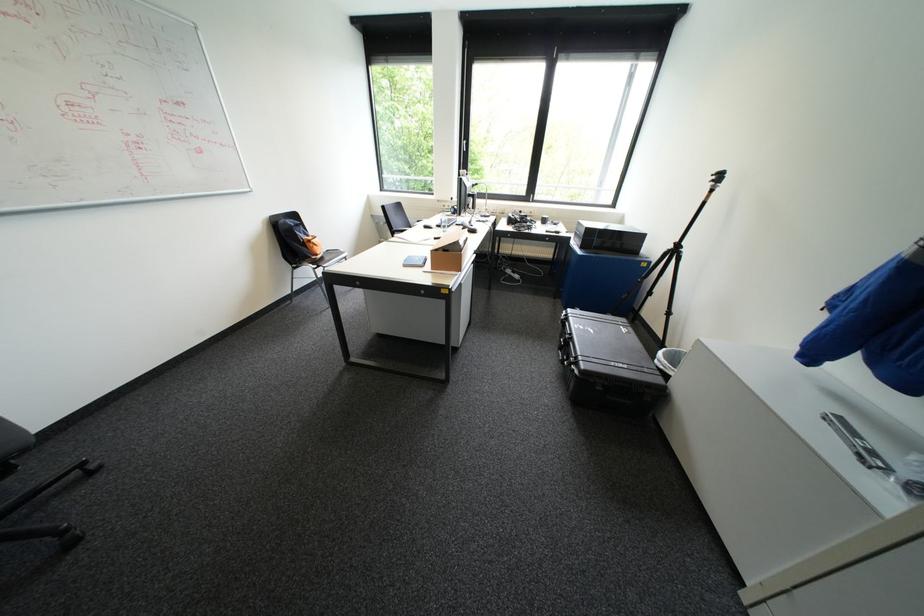
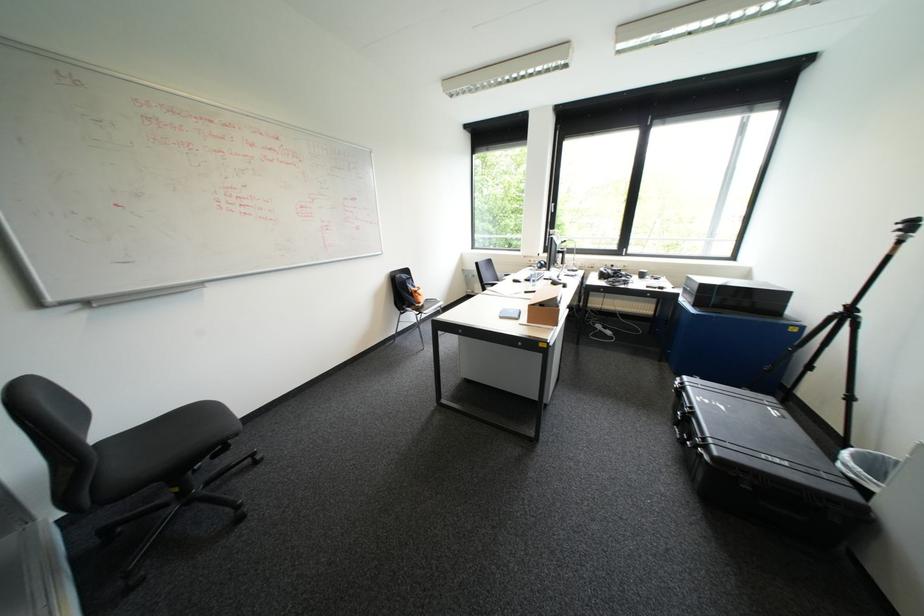
Question: Based on the continuous images, in which direction is the camera rotating? Reply with the corresponding letter.

Choices:
 (A) Left
 (B) Right
 (C) Up
 (D) Down

Answer: (A)